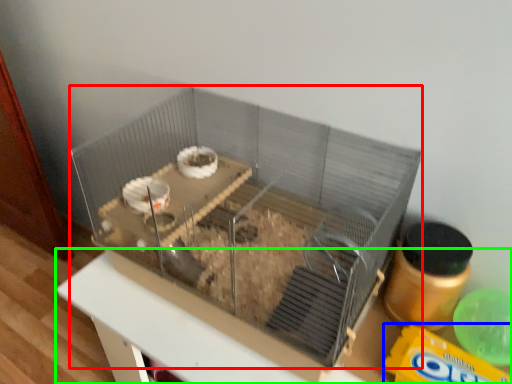
Question: Estimate the real-world distances between objects in this image. Which object is farther from glass box (highlighted by a red box), cereal (highlighted by a blue box) or table (highlighted by a green box)?

Choices:
 (A) cereal
 (B) table

Answer: (A)